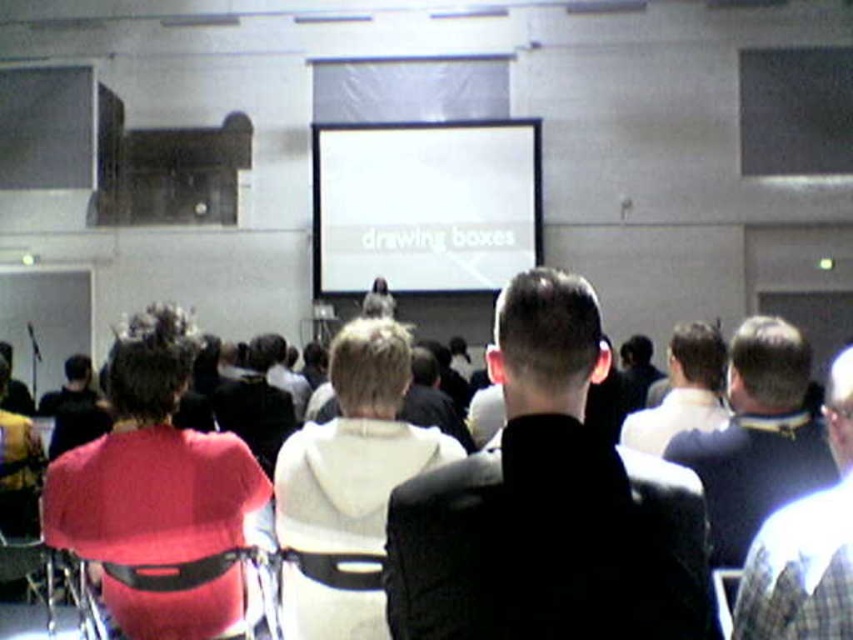
Question: Estimate the real-world distances between objects in this image. Which object is closer to the matte red shirt at center?

Choices:
 (A) dark brown leather jacket at center
 (B) black leather chair at lower left
 (C) white matte projection screen at center
 (D) plaid fabric shirt at right

Answer: (B)

Question: Which object is farther from the camera taking this photo?

Choices:
 (A) white hoodie at center
 (B) black leather chair at lower left
 (C) white matte projection screen at center

Answer: (C)

Question: Which point is closer to the camera taking this photo?

Choices:
 (A) (566, 545)
 (B) (670, 353)

Answer: (A)

Question: Can you confirm if matte red shirt at center is thinner than white hoodie at center?

Choices:
 (A) no
 (B) yes

Answer: (B)

Question: Can you confirm if plaid fabric shirt at right is positioned to the right of white hoodie at center?

Choices:
 (A) yes
 (B) no

Answer: (A)

Question: From the image, what is the correct spatial relationship of white matte projection screen at center in relation to white hoodie at center?

Choices:
 (A) below
 (B) above

Answer: (B)